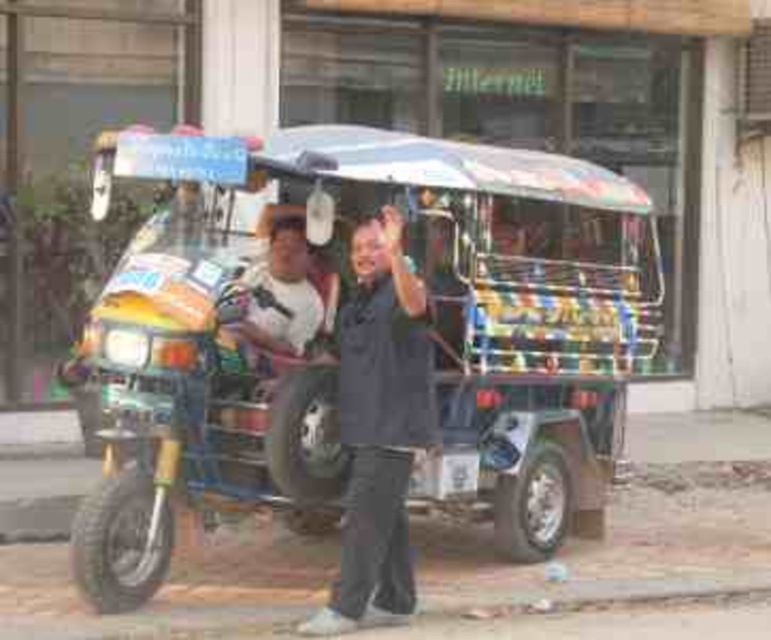
You are a delivery person who needs to place a package between the two points, point (504, 170) and point (418, 410). Which point should you place the package closer to so that it is in front of the other point?

You should place the package closer to point (418, 410) because point (504, 170) is behind point (418, 410), so placing it near the front point ensures visibility.